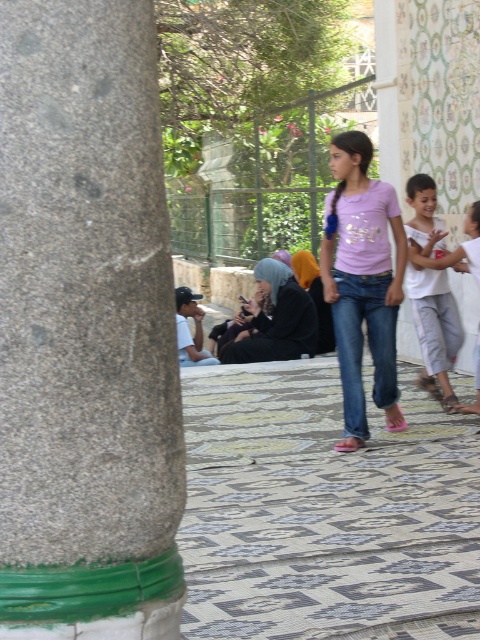
Which is more to the left, matte pink t-shirt at center or white cotton shirt at center-right?

matte pink t-shirt at center is more to the left.

Which is behind, point (381, 320) or point (430, 276)?

The point (430, 276) is more distant.

Is point (349, 262) positioned after point (411, 189)?

No, it is in front of (411, 189).

The width and height of the screenshot is (480, 640). Find the location of `matte pink t-shirt at center`. matte pink t-shirt at center is located at coordinates (362, 282).

The image size is (480, 640). Identify the location of green concrete pillar at left. (85, 330).

Does green concrete pillar at left have a lesser width compared to white cotton shirt at center-right?

Yes, green concrete pillar at left is thinner than white cotton shirt at center-right.

Is point (105, 36) positioned before point (420, 193)?

Yes, it is in front of point (420, 193).

This screenshot has height=640, width=480. In order to click on green concrete pillar at left in this screenshot , I will do `click(85, 330)`.

Can you confirm if white cotton shirt at center-right is positioned to the left of black matte hijab at center?

No, white cotton shirt at center-right is not to the left of black matte hijab at center.

Can you confirm if white cotton shirt at center-right is positioned below black matte hijab at center?

No, white cotton shirt at center-right is not below black matte hijab at center.

Which is behind, point (433, 276) or point (286, 284)?

Point (286, 284)

The width and height of the screenshot is (480, 640). I want to click on white cotton shirt at center-right, so click(434, 330).